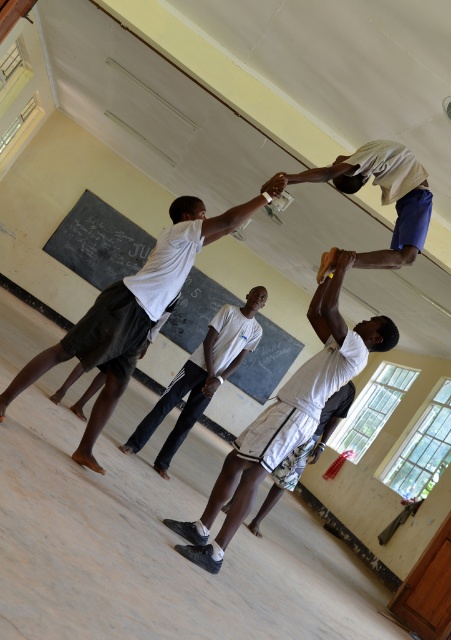
Question: Which is farther from the white matte shirt at upper center?

Choices:
 (A) white cotton shirt at center
 (B) white matte basketball at center

Answer: (B)

Question: Based on their relative distances, which object is nearer to the white matte shirt at upper center?

Choices:
 (A) white cotton shorts at center
 (B) white matte basketball at center
 (C) black chalkboard at upper center
 (D) white cotton shirt at center

Answer: (D)

Question: Can you confirm if white matte basketball at center is positioned above white cotton shirt at center?

Choices:
 (A) no
 (B) yes

Answer: (B)

Question: Does white matte shorts at center have a smaller size compared to white matte shirt at upper center?

Choices:
 (A) no
 (B) yes

Answer: (A)

Question: Does black chalkboard at upper center appear over white cotton shirt at center?

Choices:
 (A) no
 (B) yes

Answer: (B)

Question: Among these points, which one is farthest from the camera?

Choices:
 (A) (261, 504)
 (B) (64, 230)

Answer: (B)